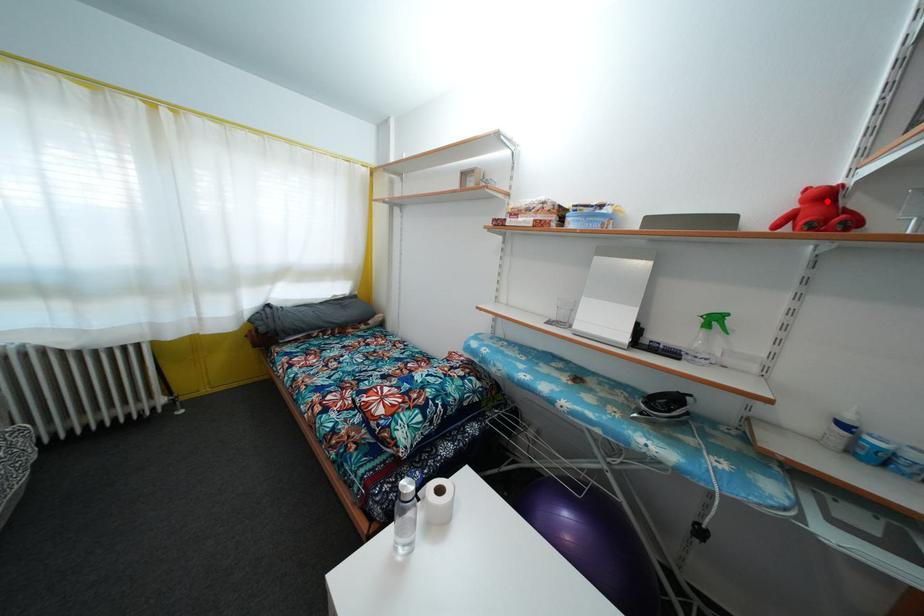
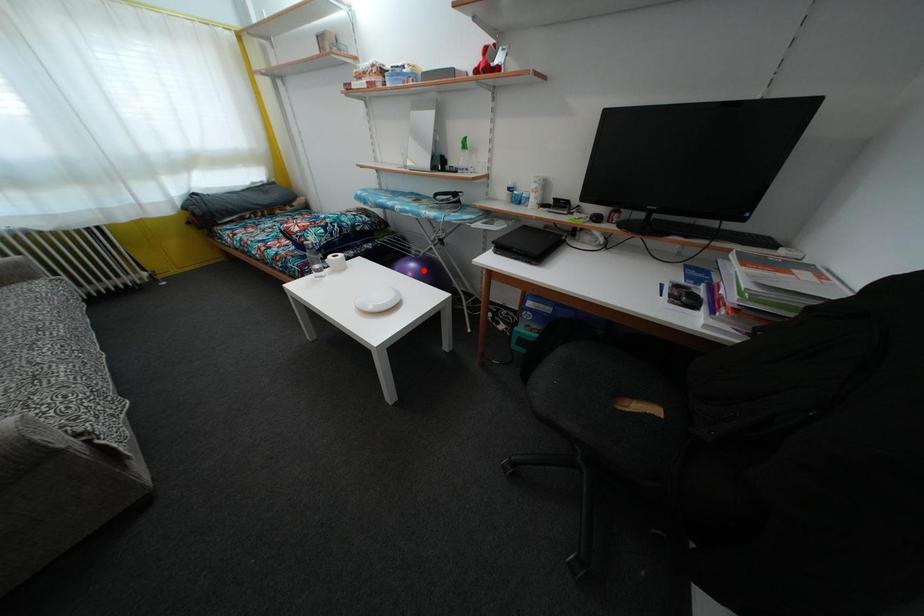
I am providing you with two images of the same scene from different viewpoints. A red point is marked on the first image and another point is marked on the second image. Is the red point in image1 aligned with the point shown in image2?

No